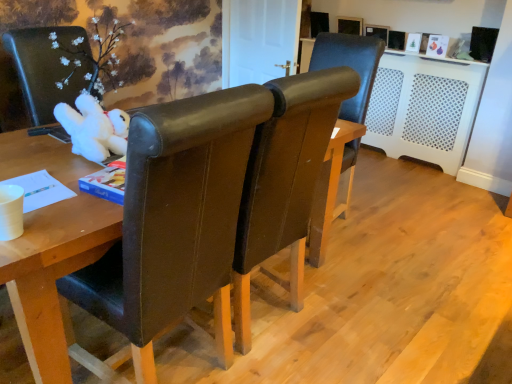
Identify the location of vacant space that is to the left of white plush toy at left. (40, 157).